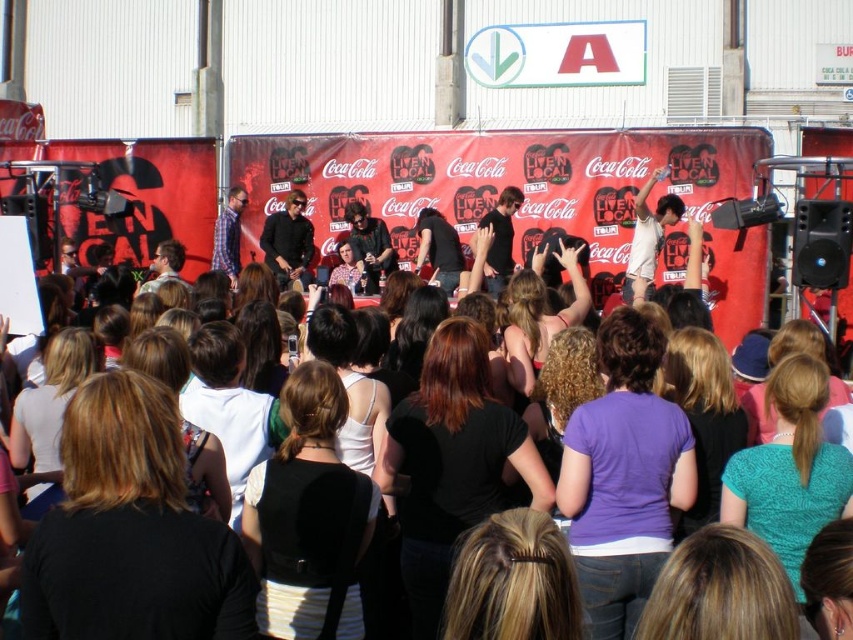
Question: Which point is closer to the camera?

Choices:
 (A) plaid shirt at center
 (B) matte black shirt at center
 (C) black leather jacket at center

Answer: (B)

Question: Which point is farther from the camera taking this photo?

Choices:
 (A) (685, 460)
 (B) (219, 269)
 (C) (279, 288)

Answer: (B)

Question: Among these points, which one is nearest to the camera?

Choices:
 (A) (264, 241)
 (B) (219, 240)

Answer: (A)

Question: Can you confirm if black leather jacket at center is thinner than plaid shirt at center?

Choices:
 (A) yes
 (B) no

Answer: (B)

Question: Does matte black shirt at center appear on the left side of black leather jacket at center?

Choices:
 (A) yes
 (B) no

Answer: (B)

Question: Can you confirm if matte black shirt at center is positioned to the right of black leather jacket at center?

Choices:
 (A) no
 (B) yes

Answer: (B)